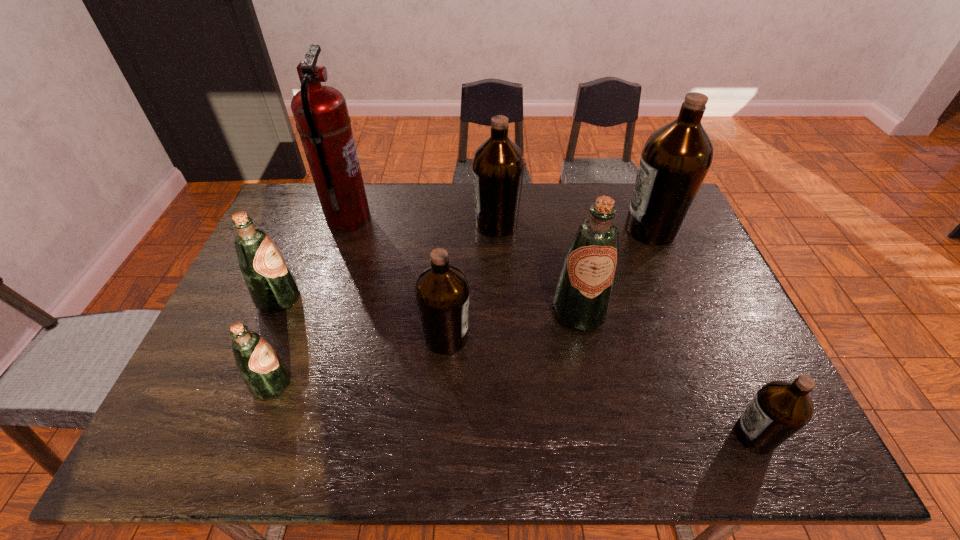
Identify which green olive oil is the second nearest to the second nearest brown olive oil. Please provide its 2D coordinates. Your answer should be formatted as a tuple, i.e. [(x, y)], where the tuple contains the x and y coordinates of a point satisfying the conditions above.

[(265, 374)]

Where is `blank area in the image that satisfies the following two spatial constraints: 1. on the front-facing side of the biggest green olive oil; 2. on the front-facing side of the seventh farthest object`? This screenshot has width=960, height=540. blank area in the image that satisfies the following two spatial constraints: 1. on the front-facing side of the biggest green olive oil; 2. on the front-facing side of the seventh farthest object is located at coordinates (593, 384).